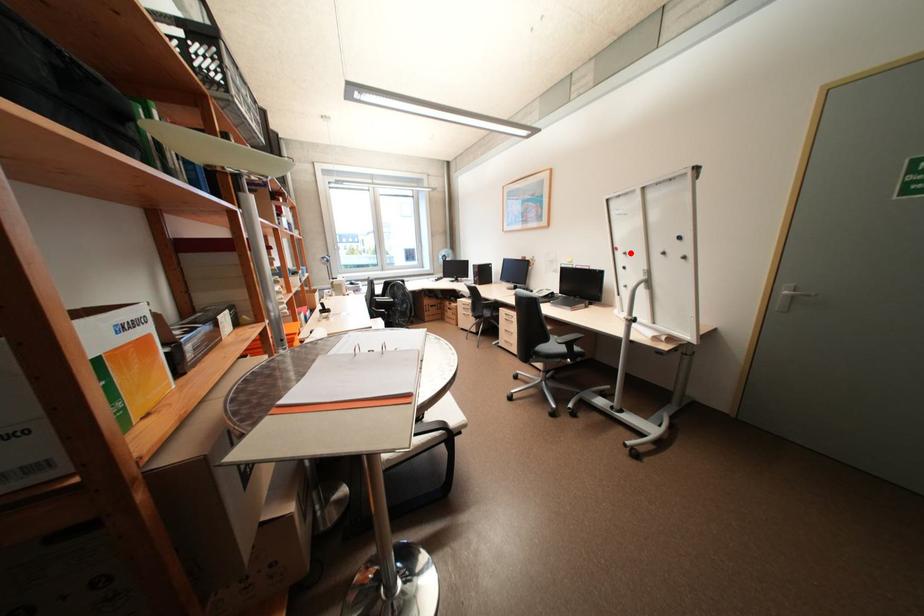
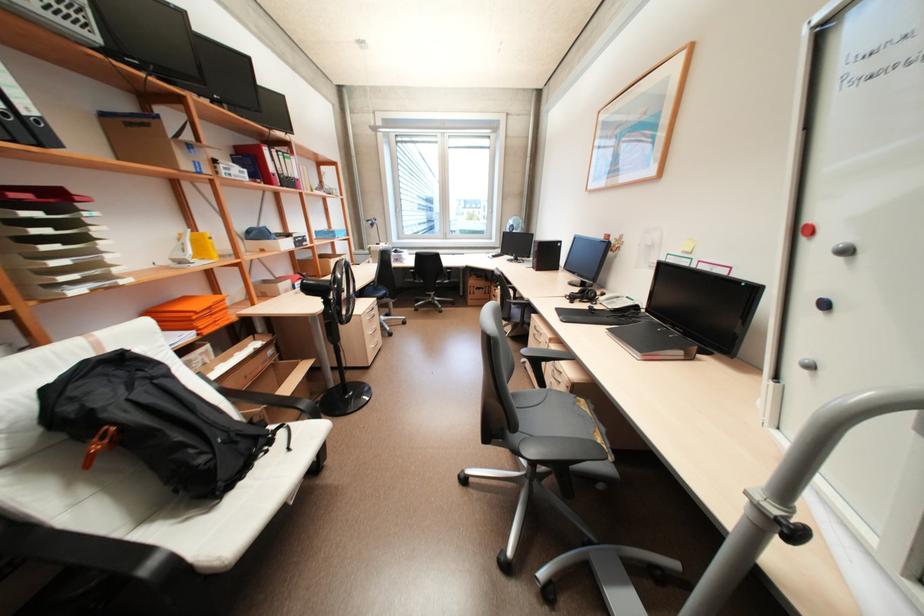
In the second image, find the point that corresponds to the highlighted location in the first image.

(852, 252)